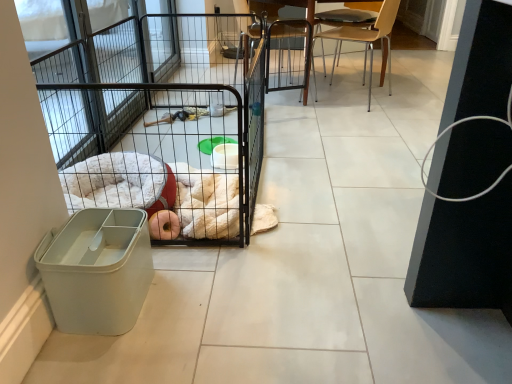
In order to click on free point behind wooden chair at center, arranged as the 2th chair when viewed from the right in this screenshot , I will do `click(283, 76)`.